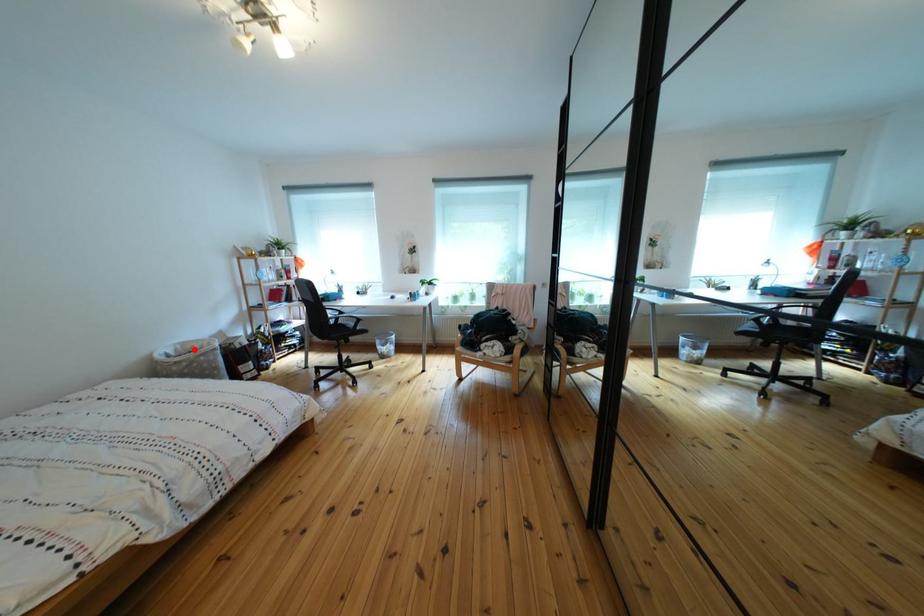
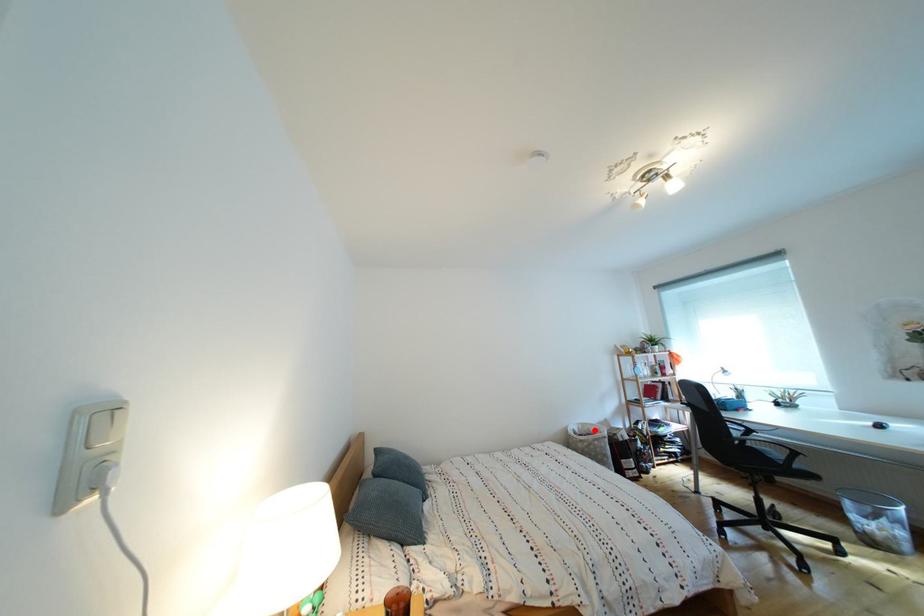
I am providing you with two images of the same scene from different viewpoints. A red point is marked on the first image and another point is marked on the second image. Are the points marked in image1 and image2 representing the same 3D position?

Yes